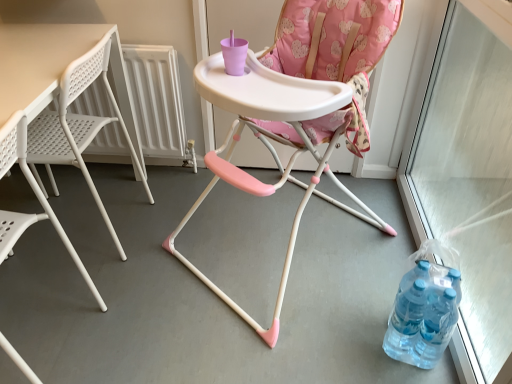
Where is `vacant space that's between pink plastic highchair at center, the 2th chair from the left, and translucent plastic bottles at lower right`? The image size is (512, 384). vacant space that's between pink plastic highchair at center, the 2th chair from the left, and translucent plastic bottles at lower right is located at coordinates (359, 316).